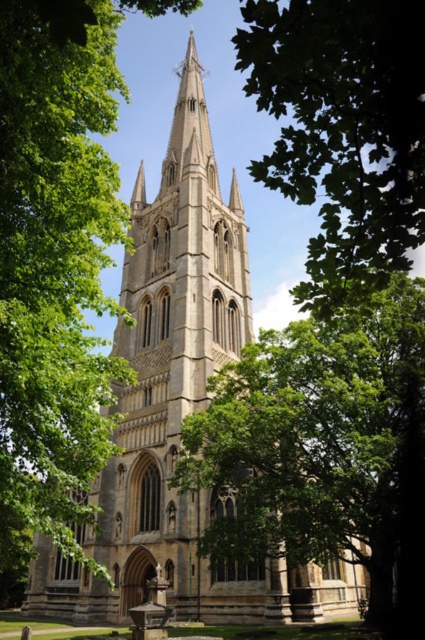
You are a photographer standing at the base of the Gothic church and want to capture both the green leafy tree at center and the green leafy tree at upper center in a single wide shot. Given that your camera has a maximum horizontal field of view of 60 degrees, can you determine if both trees will fit in the frame?

The distance between the green leafy tree at center and the green leafy tree at upper center is 17.32 meters. To determine if they fit within a 60 degree field of view, we can use trigonometry. Assuming the photographer is at the base, the angle between the two trees would depend on their distance from the camera. However, without knowing the distance from the photographer to the trees, we cannot calculate the angle. Therefore, it is impossible to confirm if both trees will fit in the frame with the given 6